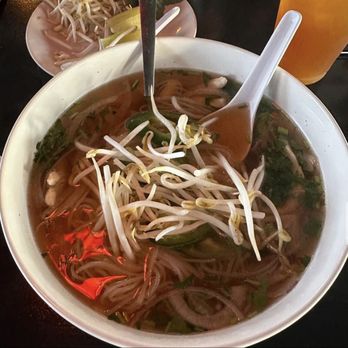
This screenshot has height=348, width=348. Identify the location of plate. (36, 44), (194, 14).